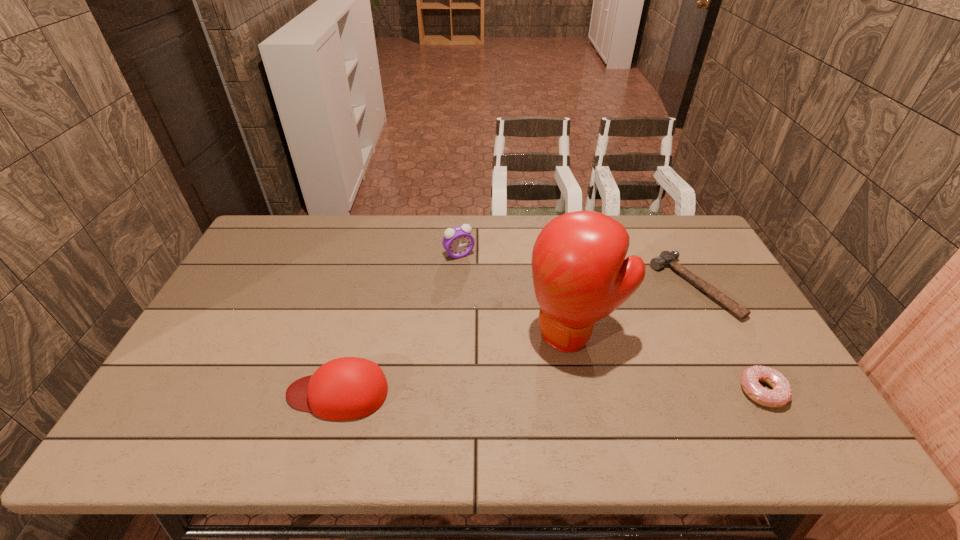
You are a GUI agent. You are given a task and a screenshot of the screen. Output one action in this format:
    pyautogui.click(x=<x>, y=<y>)
    Task: Click on the baseball cap located in the near edge section of the desktop
    The image size is (960, 540).
    Given the screenshot: What is the action you would take?
    pyautogui.click(x=347, y=388)

Where is `doughnut located at the near edge`? The height and width of the screenshot is (540, 960). doughnut located at the near edge is located at coordinates (781, 394).

Identify the location of doughnut at the right edge. The image size is (960, 540). (781, 394).

At what (x,y) coordinates should I click in order to perform the action: click on hammer that is at the right edge. Please return your answer as a coordinate pair (x, y). The width and height of the screenshot is (960, 540). Looking at the image, I should click on (666, 259).

Identify the location of object that is at the near right corner. (781, 394).

At what (x,y) coordinates should I click in order to perform the action: click on free space at the far edge of the desktop. Please return your answer as a coordinate pair (x, y). This screenshot has height=540, width=960. Looking at the image, I should click on (549, 221).

Find the location of a particular element. This screenshot has width=960, height=540. vacant space at the near edge of the desktop is located at coordinates (461, 387).

The height and width of the screenshot is (540, 960). In the image, there is a desktop. Find the location of `vacant space at the left edge`. vacant space at the left edge is located at coordinates (237, 295).

This screenshot has height=540, width=960. In the image, there is a desktop. In order to click on vacant space at the right edge in this screenshot , I will do `click(770, 350)`.

The image size is (960, 540). I want to click on vacant region at the far left corner of the desktop, so click(276, 235).